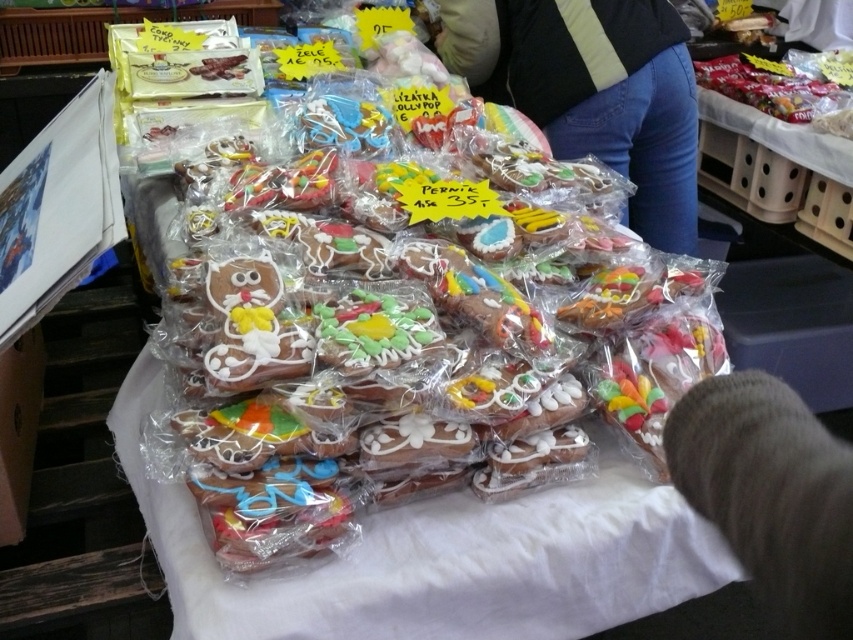
Question: Is blue jeans at center to the right of fuzzy gray hair at lower right from the viewer's perspective?

Choices:
 (A) yes
 (B) no

Answer: (A)

Question: Can you confirm if blue jeans at center is thinner than fuzzy gray hair at lower right?

Choices:
 (A) no
 (B) yes

Answer: (A)

Question: Which of the following is the farthest from the observer?

Choices:
 (A) fuzzy gray hair at lower right
 (B) blue jeans at center

Answer: (B)

Question: Can you confirm if blue jeans at center is positioned to the left of fuzzy gray hair at lower right?

Choices:
 (A) no
 (B) yes

Answer: (A)